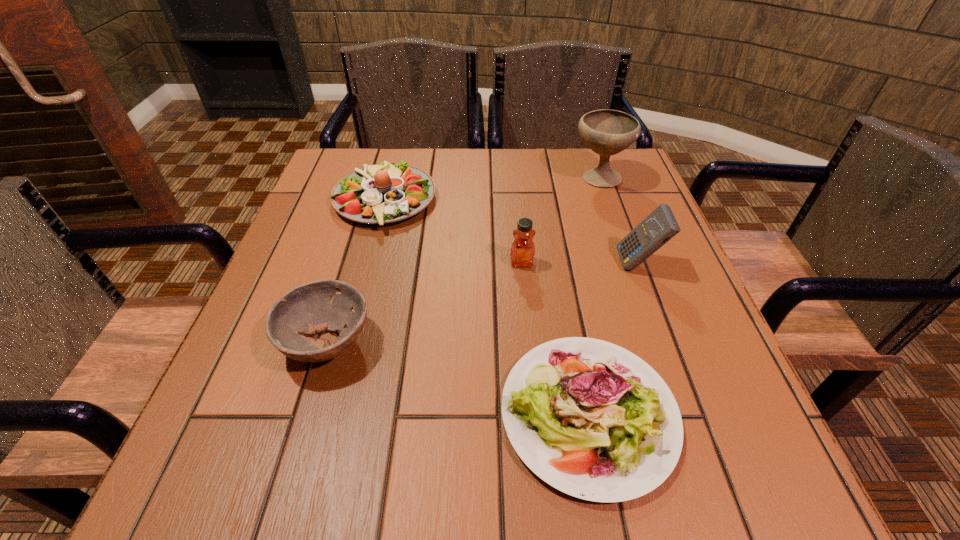
At what (x,y) coordinates should I click in order to perform the action: click on chalice. Please return your answer as a coordinate pair (x, y). Looking at the image, I should click on (607, 132).

You are a GUI agent. You are given a task and a screenshot of the screen. Output one action in this format:
    pyautogui.click(x=<x>, y=<y>)
    Task: Click on the calculator
    
    Given the screenshot: What is the action you would take?
    pyautogui.click(x=660, y=226)

What are the coordinates of `honey` in the screenshot? It's located at (522, 253).

The height and width of the screenshot is (540, 960). I want to click on bowl, so click(x=318, y=306).

Image resolution: width=960 pixels, height=540 pixels. Identify the location of the left salad plate. (387, 192).

Identify the location of the farther salad plate. The height and width of the screenshot is (540, 960). (387, 192).

Identify the location of the shortest object. The height and width of the screenshot is (540, 960). (590, 418).

Locate an element on the screen. The image size is (960, 540). the nearer salad plate is located at coordinates (590, 418).

Where is `vacant space located 0.340m on the left of the chalice`? The image size is (960, 540). vacant space located 0.340m on the left of the chalice is located at coordinates (439, 178).

Find the location of a particular element. vacant space located 0.230m on the front-facing side of the calculator is located at coordinates (506, 264).